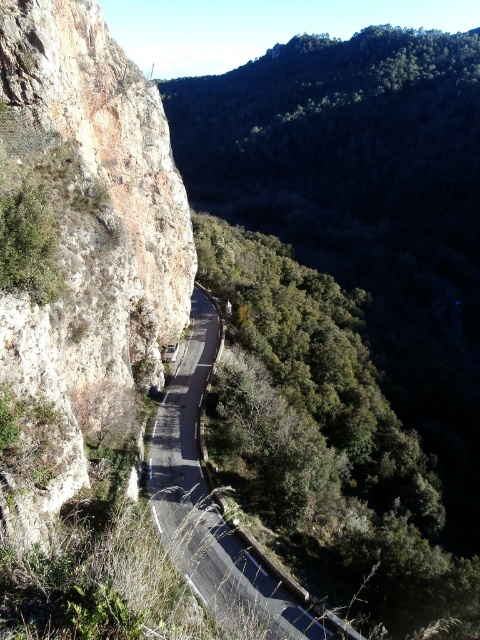
Is rusty rock cliff at left wider than asphalt road at center?

No, rusty rock cliff at left is not wider than asphalt road at center.

Who is more forward, (12,506) or (273,609)?

Point (12,506)

The height and width of the screenshot is (640, 480). Identify the location of rusty rock cliff at left. (79, 252).